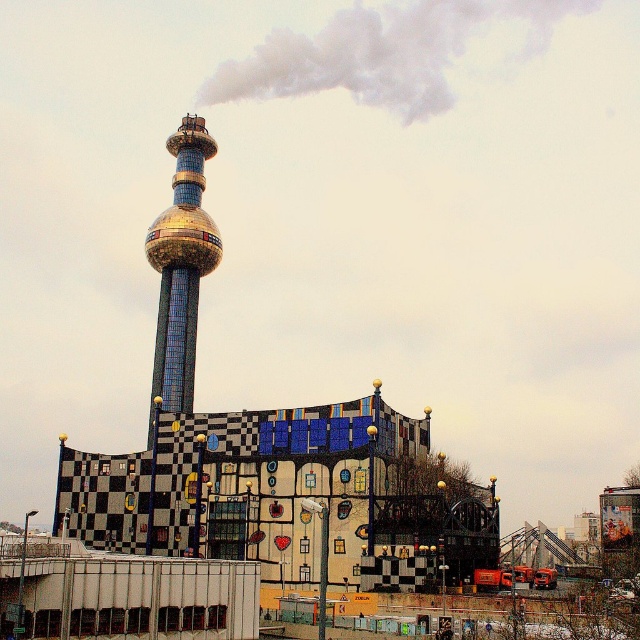
Question: Which object appears closest to the camera in this image?

Choices:
 (A) white smoke at upper center
 (B) gold mosaic tower at center

Answer: (B)

Question: Can you confirm if white smoke at upper center is positioned to the right of gold mosaic tower at center?

Choices:
 (A) yes
 (B) no

Answer: (A)

Question: Is white smoke at upper center to the left of gold mosaic tower at center from the viewer's perspective?

Choices:
 (A) no
 (B) yes

Answer: (A)

Question: Which of the following is the closest to the observer?

Choices:
 (A) (189, 346)
 (B) (266, 88)

Answer: (A)

Question: Among these points, which one is farthest from the camera?

Choices:
 (A) (392, 28)
 (B) (189, 195)

Answer: (A)

Question: Is white smoke at upper center above gold mosaic tower at center?

Choices:
 (A) yes
 (B) no

Answer: (A)